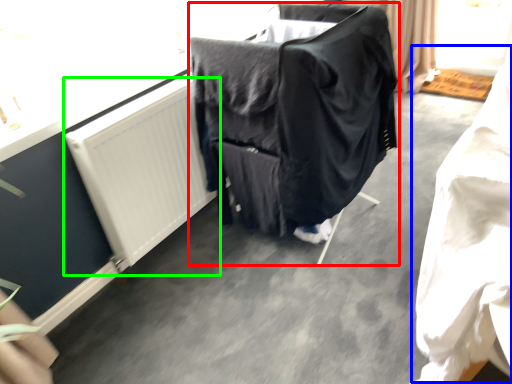
Question: Which object is the farthest from furniture (highlighted by a red box)? Choose among these: clothing (highlighted by a blue box) or radiator (highlighted by a green box).

Choices:
 (A) clothing
 (B) radiator

Answer: (A)